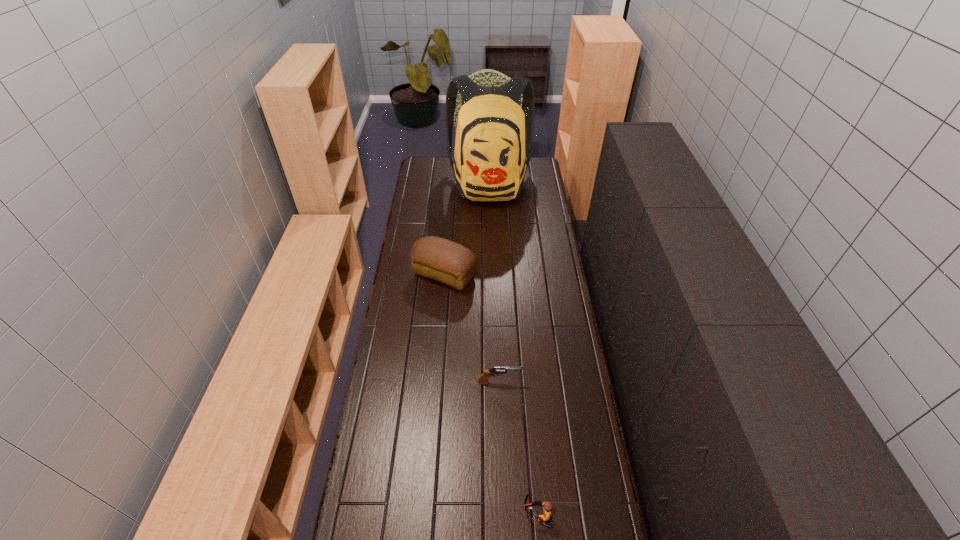
The height and width of the screenshot is (540, 960). I want to click on vacant space located 0.310m holding a crossbow in the hands of the nearest object, so click(x=418, y=514).

Locate an element on the screen. vacant space situated 0.280m holding a crossbow in the hands of the nearest object is located at coordinates (428, 514).

Identify the location of object located in the far edge section of the desktop. The height and width of the screenshot is (540, 960). (490, 163).

At what (x,y) coordinates should I click in order to perform the action: click on object that is at the left edge. Please return your answer as a coordinate pair (x, y). The height and width of the screenshot is (540, 960). Looking at the image, I should click on (443, 260).

The image size is (960, 540). Find the location of `object that is at the right edge`. object that is at the right edge is located at coordinates tap(490, 163).

Locate an element on the screen. The height and width of the screenshot is (540, 960). object that is at the far right corner is located at coordinates (490, 163).

Find the location of a particular element. vacant space at the left edge of the desktop is located at coordinates (400, 468).

Identify the location of vacant space at the right edge of the desktop. (568, 349).

In the image, there is a desktop. Where is `free region at the far left corner`? free region at the far left corner is located at coordinates (425, 157).

Locate an element on the screen. The image size is (960, 540). empty space between the second farthest object and the nearest object is located at coordinates (491, 394).